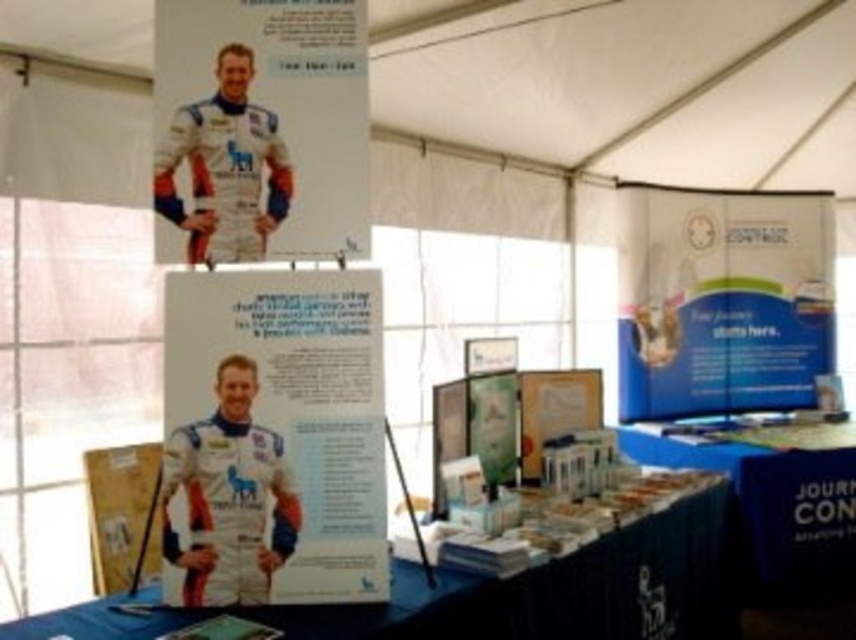
You are standing at the entrance of the tent and want to reach the blue fabric table at center. Which direction should you head towards?

The blue fabric table at center is located at point [497,595], so you should head towards the center of the tent to reach it.

You are an event planner checking the setup. The blue fabric banner at right and the matte white spacesuit at center are both part of the display. Which object is taller?

The blue fabric banner at right is taller than the matte white spacesuit at center according to the description provided.